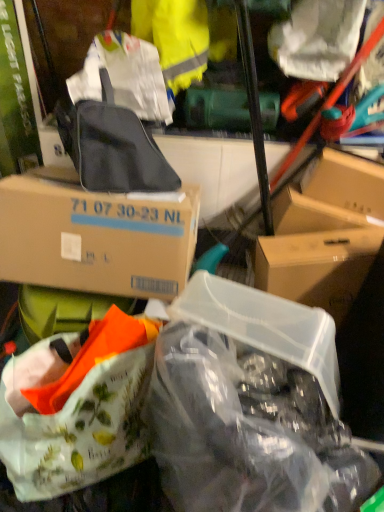
Question: From the image's perspective, is white fabric handbag at lower left under matte black backpack at upper center?

Choices:
 (A) yes
 (B) no

Answer: (A)

Question: Considering the relative positions of white fabric handbag at lower left and matte black backpack at upper center in the image provided, is white fabric handbag at lower left in front of matte black backpack at upper center?

Choices:
 (A) no
 (B) yes

Answer: (B)

Question: Are white fabric handbag at lower left and matte black backpack at upper center beside each other?

Choices:
 (A) yes
 (B) no

Answer: (B)

Question: Is white fabric handbag at lower left at the left side of matte black backpack at upper center?

Choices:
 (A) no
 (B) yes

Answer: (B)

Question: Does white fabric handbag at lower left have a larger size compared to matte black backpack at upper center?

Choices:
 (A) no
 (B) yes

Answer: (B)

Question: Does white fabric handbag at lower left turn towards matte black backpack at upper center?

Choices:
 (A) no
 (B) yes

Answer: (A)

Question: Does brown cardboard box at upper left, marked as the 2th box in a right-to-left arrangement, have a greater width compared to white matte plastic bag at upper right, which is the second plastic bag in bottom-to-top order?

Choices:
 (A) no
 (B) yes

Answer: (B)

Question: Can you confirm if brown cardboard box at upper left, marked as the 2th box in a right-to-left arrangement, is smaller than white matte plastic bag at upper right, positioned as the first plastic bag in top-to-bottom order?

Choices:
 (A) yes
 (B) no

Answer: (B)

Question: Does brown cardboard box at upper left, the first box from the left, come behind white matte plastic bag at upper right, positioned as the first plastic bag in top-to-bottom order?

Choices:
 (A) no
 (B) yes

Answer: (A)

Question: Is brown cardboard box at upper left, marked as the 2th box in a right-to-left arrangement, shorter than white matte plastic bag at upper right, positioned as the first plastic bag in top-to-bottom order?

Choices:
 (A) yes
 (B) no

Answer: (B)

Question: Can you confirm if brown cardboard box at upper left, the first box from the left, is bigger than white matte plastic bag at upper right, which is the second plastic bag in bottom-to-top order?

Choices:
 (A) no
 (B) yes

Answer: (B)

Question: Does brown cardboard box at upper left, the first box from the left, have a lesser width compared to white matte plastic bag at upper right, which is the second plastic bag in bottom-to-top order?

Choices:
 (A) yes
 (B) no

Answer: (B)

Question: Is yellow fabric at upper center not near white matte plastic bag at upper right, which is the second plastic bag in bottom-to-top order?

Choices:
 (A) no
 (B) yes

Answer: (A)